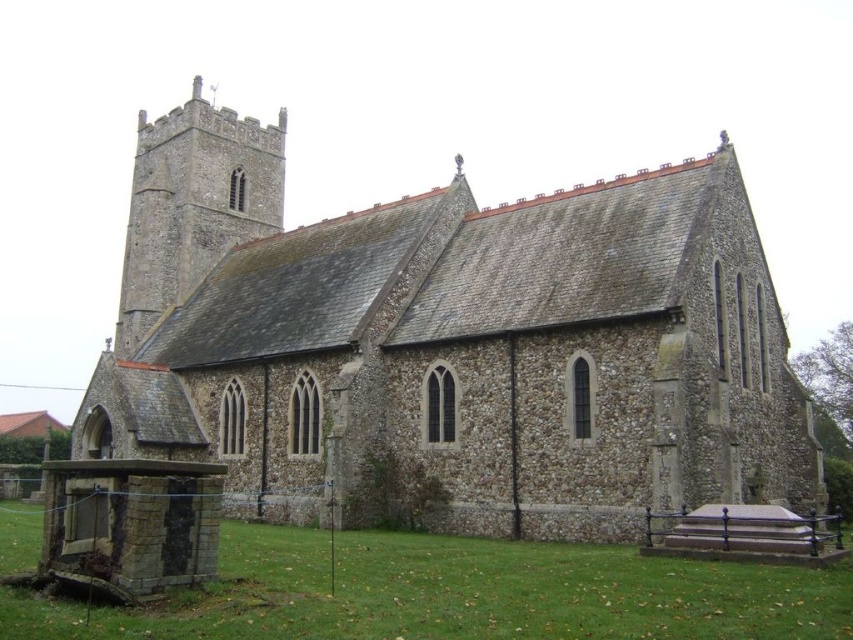
Is green grass at lower left below gray stone tower at upper left?

Yes.

Is green grass at lower left positioned at the back of gray stone tower at upper left?

No, it is not.

Who is more distant from viewer, [807,612] or [235,189]?

Point [235,189]

Locate an element on the screen. green grass at lower left is located at coordinates (456, 595).